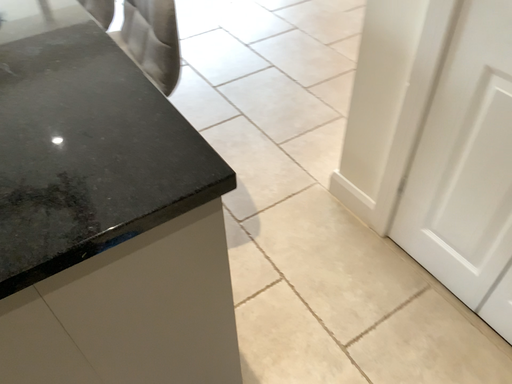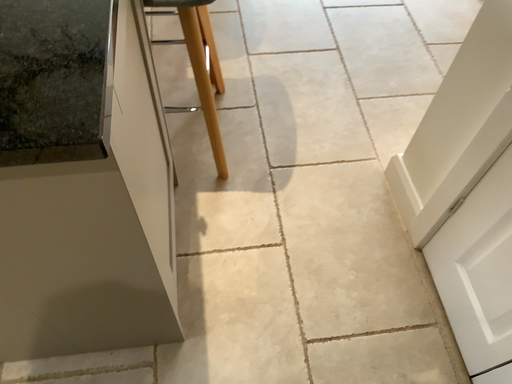
Question: Which way did the camera rotate in the video?

Choices:
 (A) rotated right
 (B) rotated left

Answer: (B)